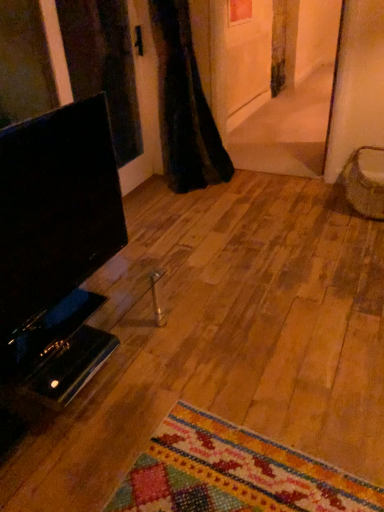
Looking at this image, what is the approximate width of white matte door at upper center?

white matte door at upper center is 6.18 inches in width.

What is the approximate height of white matte door at upper center?

white matte door at upper center is 60.40 centimeters tall.

Image resolution: width=384 pixels, height=512 pixels. Describe the element at coordinates (239, 59) in the screenshot. I see `white matte door at upper center` at that location.

Where is `white matte door at upper center`? The image size is (384, 512). white matte door at upper center is located at coordinates (239, 59).

You are a GUI agent. You are given a task and a screenshot of the screen. Output one action in this format:
    pyautogui.click(x=<x>, y=<y>)
    Task: Click on the white matte door at upper center
    The height and width of the screenshot is (512, 384).
    Given the screenshot: What is the action you would take?
    pyautogui.click(x=239, y=59)